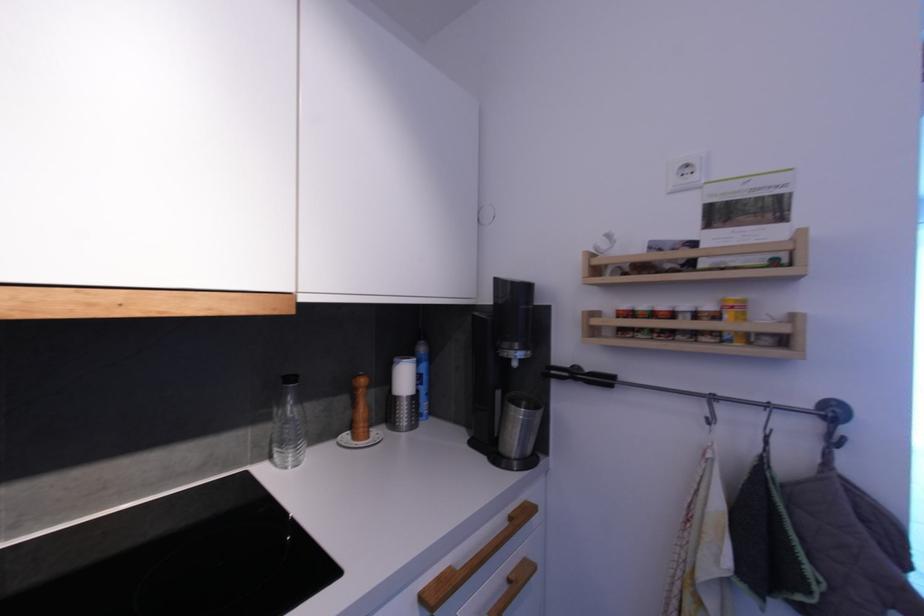
In order to click on soda maker lever in this screenshot , I will do `click(580, 376)`.